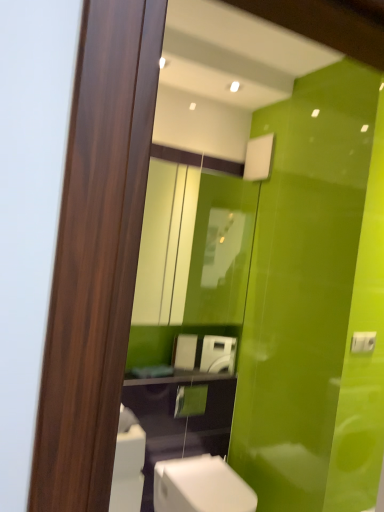
Question: Can you confirm if white glossy toilet at lower center is thinner than matte glass mirror at upper center?

Choices:
 (A) yes
 (B) no

Answer: (B)

Question: From the image's perspective, is white glossy toilet at lower center over matte glass mirror at upper center?

Choices:
 (A) no
 (B) yes

Answer: (A)

Question: Does white glossy toilet at lower center have a lesser height compared to matte glass mirror at upper center?

Choices:
 (A) no
 (B) yes

Answer: (B)

Question: Is white glossy toilet at lower center far from matte glass mirror at upper center?

Choices:
 (A) yes
 (B) no

Answer: (A)

Question: Is matte glass mirror at upper center surrounded by white glossy toilet at lower center?

Choices:
 (A) yes
 (B) no

Answer: (B)

Question: Is white glossy toilet at lower center beside matte glass mirror at upper center?

Choices:
 (A) yes
 (B) no

Answer: (B)

Question: Considering the relative sizes of white glossy toilet at lower center and white glossy washing machine at center in the image provided, is white glossy toilet at lower center smaller than white glossy washing machine at center?

Choices:
 (A) no
 (B) yes

Answer: (A)

Question: Is white glossy washing machine at center surrounded by white glossy toilet at lower center?

Choices:
 (A) no
 (B) yes

Answer: (A)

Question: Considering the relative positions of white glossy toilet at lower center and white glossy washing machine at center in the image provided, is white glossy toilet at lower center to the left of white glossy washing machine at center from the viewer's perspective?

Choices:
 (A) no
 (B) yes

Answer: (B)

Question: Is white glossy toilet at lower center thinner than white glossy washing machine at center?

Choices:
 (A) no
 (B) yes

Answer: (A)

Question: Considering the relative sizes of white glossy toilet at lower center and white glossy washing machine at center in the image provided, is white glossy toilet at lower center bigger than white glossy washing machine at center?

Choices:
 (A) no
 (B) yes

Answer: (B)

Question: Is white glossy toilet at lower center taller than white glossy washing machine at center?

Choices:
 (A) yes
 (B) no

Answer: (A)

Question: Is matte glass mirror at upper center facing towards white glossy washing machine at center?

Choices:
 (A) yes
 (B) no

Answer: (B)